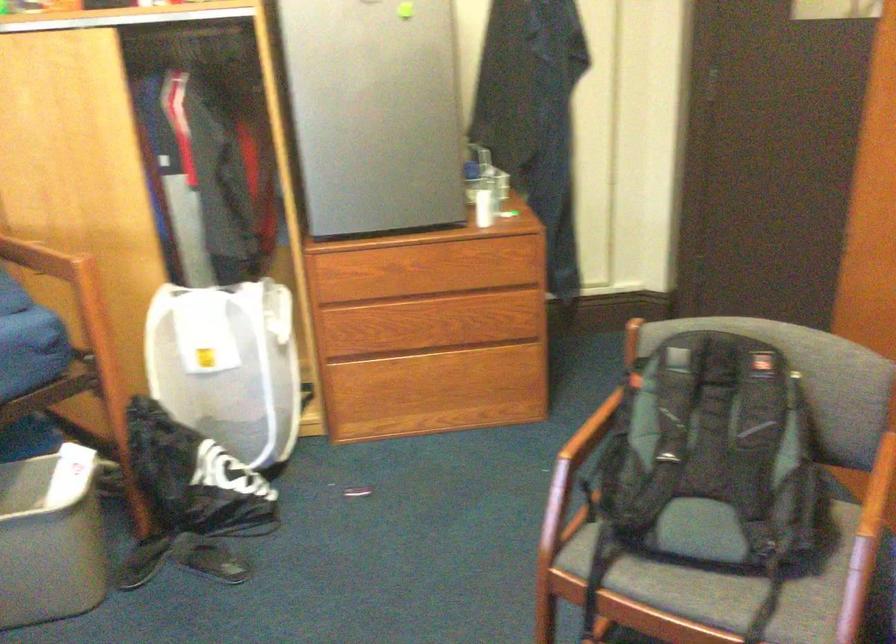
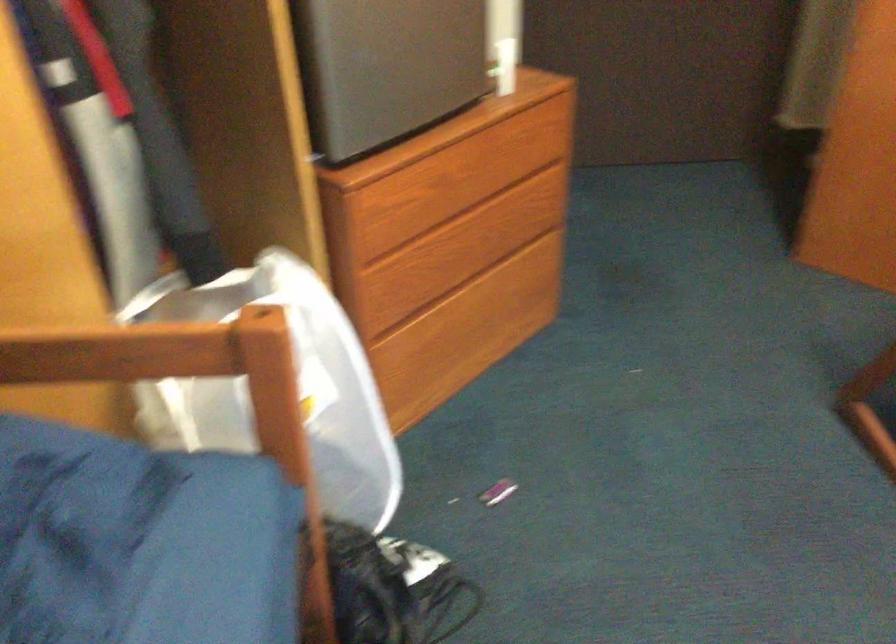
Find the pixel in the second image that matches point 421,259 in the first image.

(462, 152)